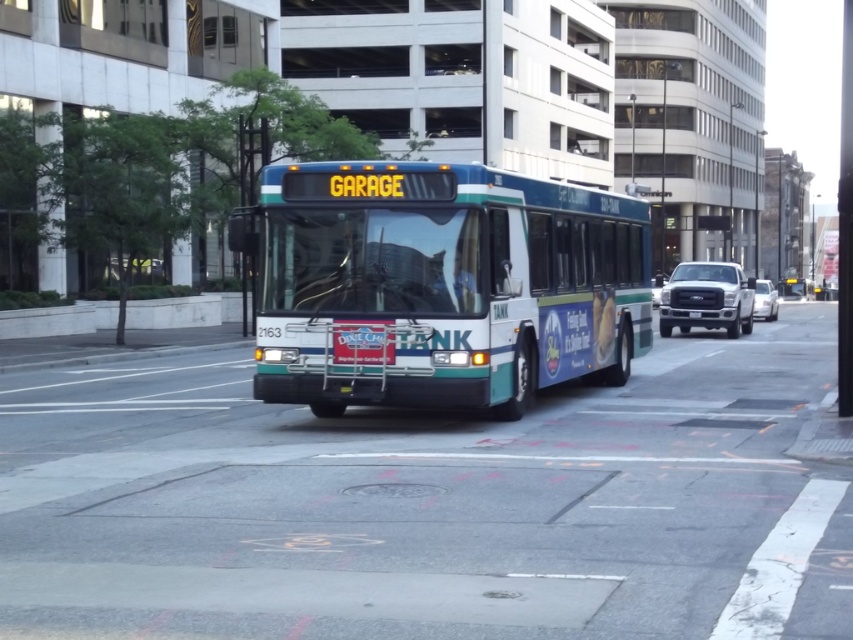
You are driving a car and want to park behind the white matte truck at right. The parking spot behind the truck is 30 meters long. Can you safely park there?

The white matte truck at right is 29.66 meters from the camera. Since the parking spot behind it is 30 meters long, you can safely park there as the distance available is sufficient for your vehicle.

You are standing on the sidewalk and see two points marked on the road ahead. The first is at point (709, 304) and the second is at point (689, 317). Which point is closer to you?

Point (709, 304) is closer to the viewer than point (689, 317).

You are a pedestrian standing at the sidewalk and want to cross the street. You see the teal glossy bus at center and the white matte truck at right. Which vehicle is closer to you?

The teal glossy bus at center is closer to the viewer than the white matte truck at right.